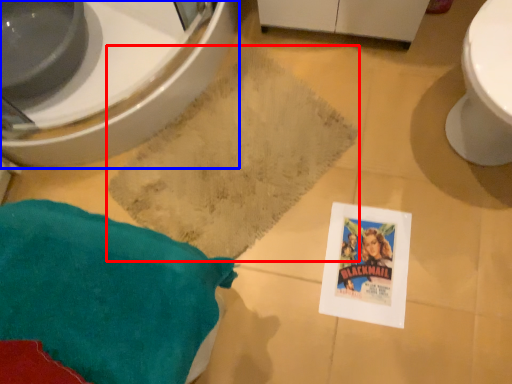
Question: Which object appears farthest to the camera in this image, bath mat (highlighted by a red box) or bidet (highlighted by a blue box)?

Choices:
 (A) bath mat
 (B) bidet

Answer: (A)